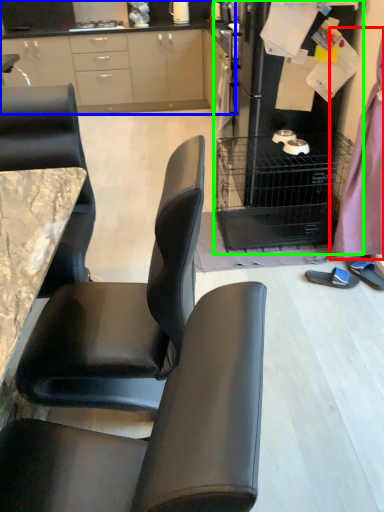
Question: Which object is positioned closest to dress (highlighted by a red box)? Select from cabinetry (highlighted by a blue box) and appliance (highlighted by a green box).

Choices:
 (A) cabinetry
 (B) appliance

Answer: (B)